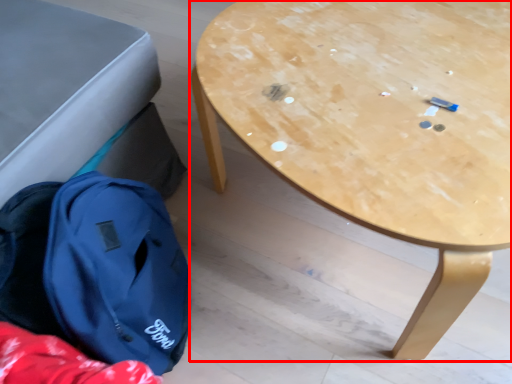
Question: In this image, where is table (annotated by the red box) located relative to backpack?

Choices:
 (A) right
 (B) left

Answer: (A)